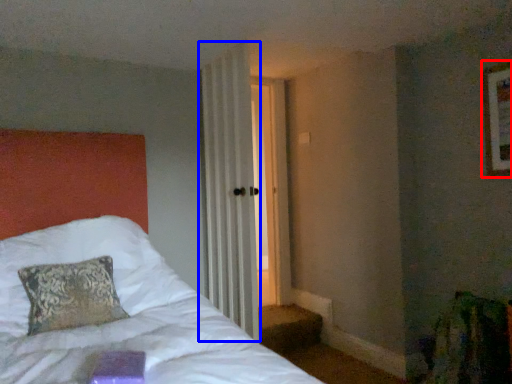
Question: Which of the following is the closest to the observer, picture frame (highlighted by a red box) or curtain (highlighted by a blue box)?

Choices:
 (A) picture frame
 (B) curtain

Answer: (A)